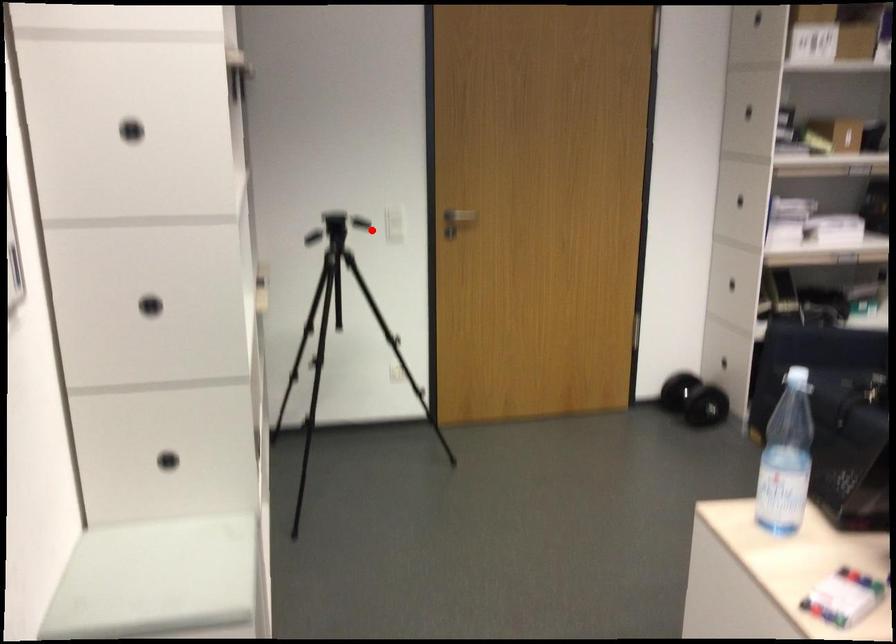
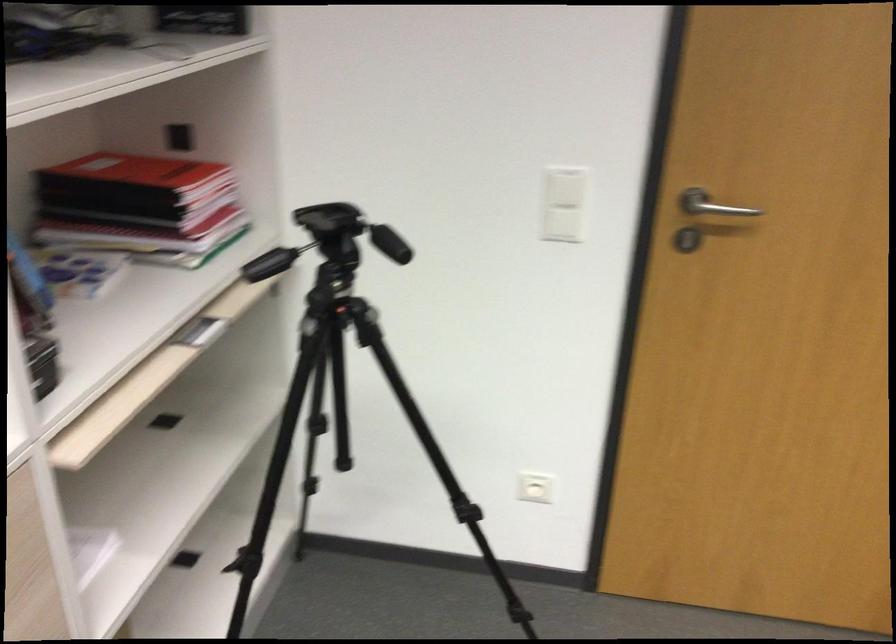
Question: I am providing you with two images of the same scene from different viewpoints. In image1, a red point is highlighted. Considering the same 3D point in image2, which of the following is correct?

Choices:
 (A) It is closer
 (B) It is farther

Answer: (A)